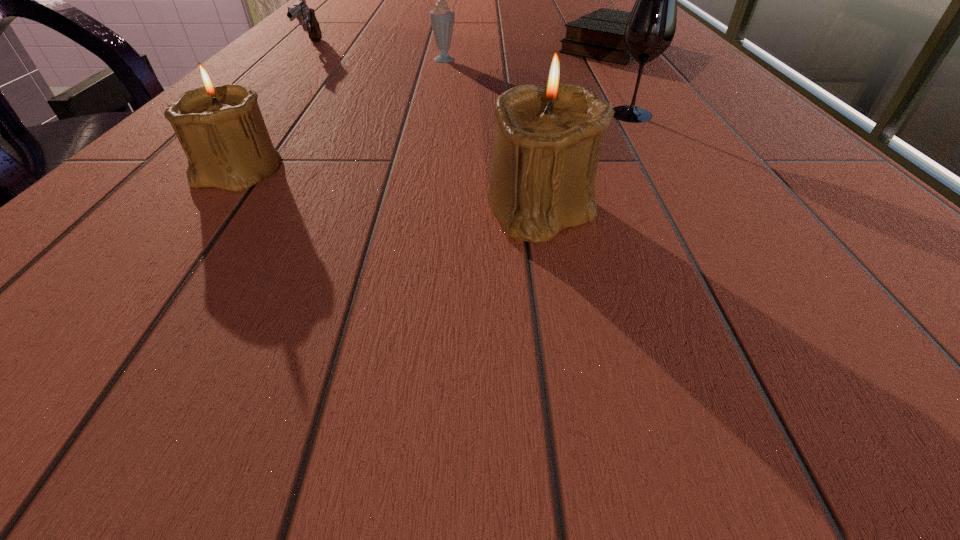
At what (x,y) coordinates should I click in order to perform the action: click on vacant region located 0.150m on the straw side of the third object from left to right. Please return your answer as a coordinate pair (x, y). This screenshot has width=960, height=540. Looking at the image, I should click on (444, 91).

At what (x,y) coordinates should I click in order to perform the action: click on vacant space located 0.260m on the front of the book. Please return your answer as a coordinate pair (x, y). Looking at the image, I should click on (663, 122).

Image resolution: width=960 pixels, height=540 pixels. I want to click on blank area located at the barrel of the fifth tallest object, so click(290, 70).

Find the location of a particular element. This screenshot has height=540, width=960. object that is at the near edge is located at coordinates (548, 136).

The width and height of the screenshot is (960, 540). I want to click on candle_holder present at the left edge, so click(221, 129).

You are a GUI agent. You are given a task and a screenshot of the screen. Output one action in this format:
    pyautogui.click(x=<x>, y=<y>)
    Task: Click on the pistol that is at the left edge
    This screenshot has width=960, height=540.
    Given the screenshot: What is the action you would take?
    pyautogui.click(x=306, y=16)

Locate an element on the screen. This screenshot has height=540, width=960. object positioned at the right edge is located at coordinates (600, 34).

This screenshot has width=960, height=540. What are the coordinates of `vacant area at the near edge of the desktop` in the screenshot? It's located at (508, 265).

Image resolution: width=960 pixels, height=540 pixels. What are the coordinates of `free space at the left edge of the desktop` in the screenshot? It's located at (97, 222).

In the image, there is a desktop. Identify the location of blank space at the right edge. The height and width of the screenshot is (540, 960). (656, 86).